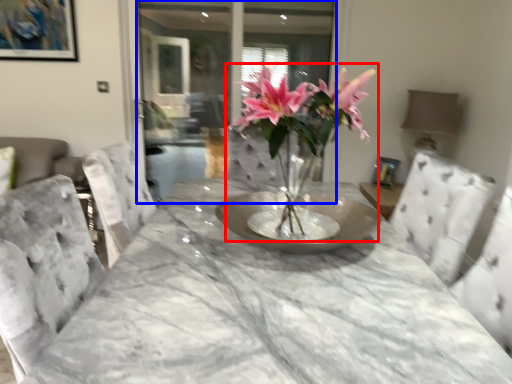
Question: Which of the following is the farthest to the observer, houseplant (highlighted by a red box) or glass door (highlighted by a blue box)?

Choices:
 (A) houseplant
 (B) glass door

Answer: (B)